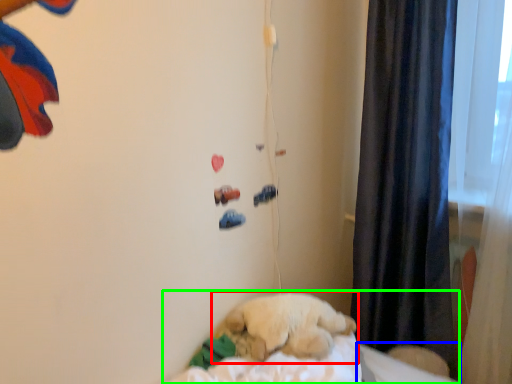
Question: Based on their relative distances, which object is farther from dog (highlighted by a red box)? Choose from sheet (highlighted by a blue box) and bed (highlighted by a green box).

Choices:
 (A) sheet
 (B) bed

Answer: (A)